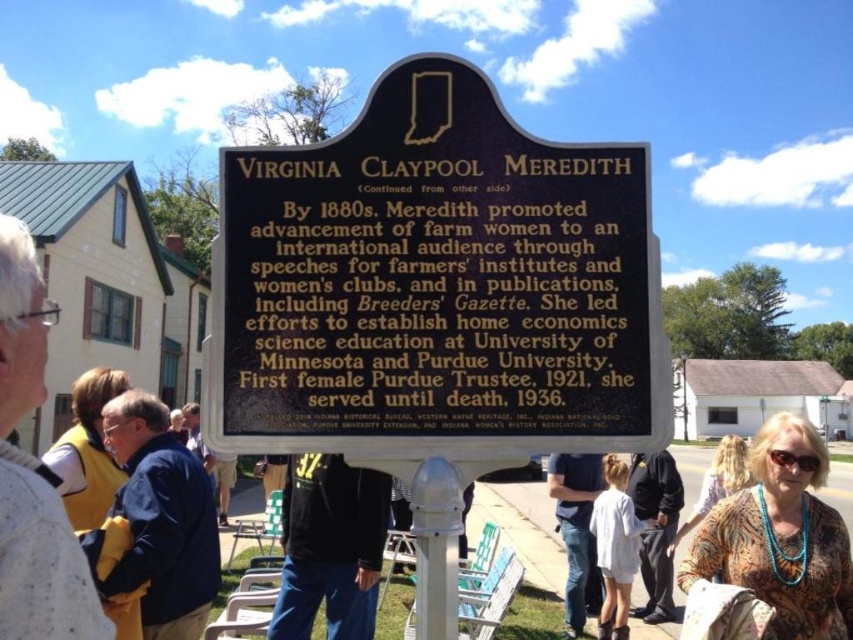
Does black polished stone sign at center have a lesser height compared to turquoise beaded necklace at center?

Indeed, black polished stone sign at center has a lesser height compared to turquoise beaded necklace at center.

Does black polished stone sign at center have a greater height compared to turquoise beaded necklace at center?

In fact, black polished stone sign at center may be shorter than turquoise beaded necklace at center.

Who is more distant from viewer, (573, 308) or (785, 592)?

Point (785, 592)

This screenshot has height=640, width=853. I want to click on black polished stone sign at center, so click(434, 285).

Between turquoise beaded necklace at center and printed floral blouse at center, which one has less height?

turquoise beaded necklace at center is shorter.

Between turquoise beaded necklace at center and printed floral blouse at center, which one is positioned higher?

turquoise beaded necklace at center is higher up.

Who is more distant from viewer, (758, 506) or (740, 468)?

The point (740, 468) is behind.

Locate an element on the screen. Image resolution: width=853 pixels, height=640 pixels. turquoise beaded necklace at center is located at coordinates (780, 536).

Does gray knit sweater at left have a lesser width compared to dark gray fabric pants at center?

Indeed, gray knit sweater at left has a lesser width compared to dark gray fabric pants at center.

Which is more to the right, gray knit sweater at left or dark gray fabric pants at center?

dark gray fabric pants at center

Does point (22, 332) come farther from viewer compared to point (631, 614)?

That is False.

You are a GUI agent. You are given a task and a screenshot of the screen. Output one action in this format:
    pyautogui.click(x=<x>, y=<y>)
    Task: Click on the gray knit sweater at left
    Image resolution: width=853 pixels, height=640 pixels.
    Given the screenshot: What is the action you would take?
    pyautogui.click(x=33, y=472)